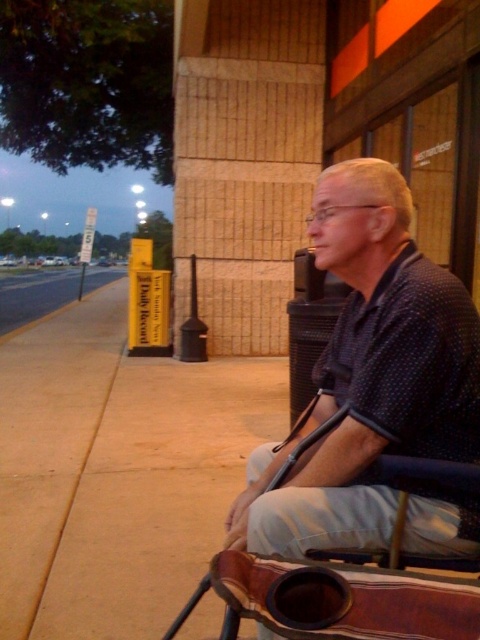
Question: Which object is closer to the camera taking this photo?

Choices:
 (A) paved asphalt at left
 (B) polka dot shirt at center

Answer: (B)

Question: Can you confirm if polka dot shirt at center is thinner than paved asphalt at left?

Choices:
 (A) no
 (B) yes

Answer: (B)

Question: Which of the following is the farthest from the observer?

Choices:
 (A) (86, 285)
 (B) (404, 300)

Answer: (A)

Question: Which object is farther from the camera taking this photo?

Choices:
 (A) polka dot shirt at center
 (B) paved asphalt at left

Answer: (B)

Question: Is polka dot shirt at center thinner than paved asphalt at left?

Choices:
 (A) yes
 (B) no

Answer: (A)

Question: Is polka dot shirt at center thinner than paved asphalt at left?

Choices:
 (A) yes
 (B) no

Answer: (A)